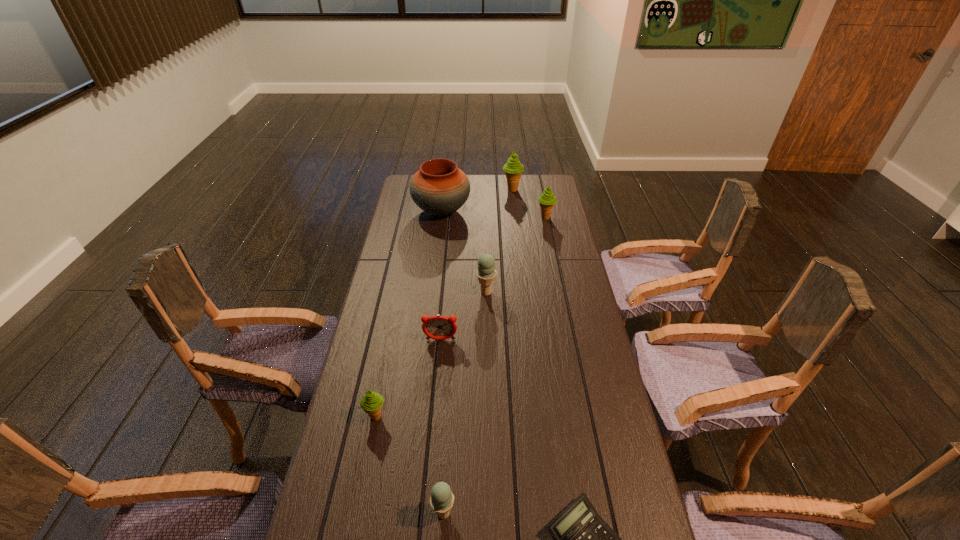
Identify the location of ice cream that is the nearest to the smaller blue ice cream. (371, 403).

Select which green icecream is the third closest to the calculator. Please provide its 2D coordinates. Your answer should be formatted as a tuple, i.e. [(x, y)], where the tuple contains the x and y coordinates of a point satisfying the conditions above.

[(513, 169)]

The image size is (960, 540). Identify the location of green icecream that stands as the closest to the tallest ice cream. (547, 200).

Identify the location of free space that satisfies the following two spatial constraints: 1. on the front side of the red pottery; 2. on the right side of the bigger blue ice cream. (432, 292).

I want to click on free space that satisfies the following two spatial constraints: 1. on the back side of the third ice cream from right to left; 2. on the left side of the left blue ice cream, so click(457, 292).